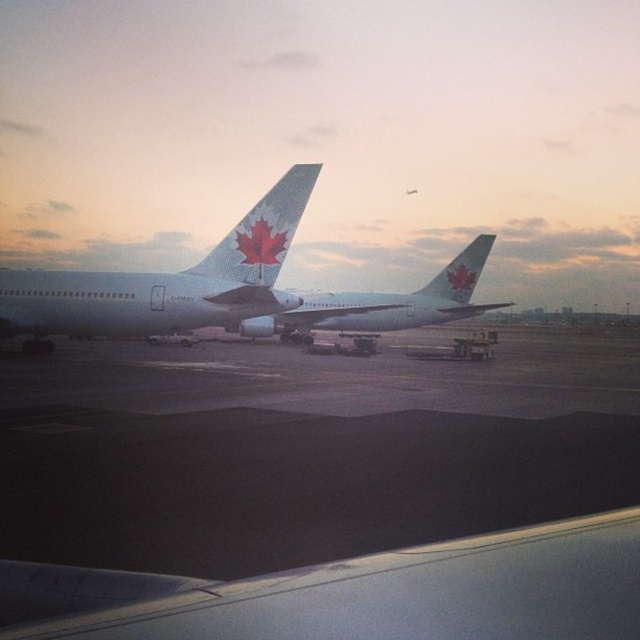
You are a flight attendant on an airplane and you notice two objects in the scene. One is the matte white airplane at center and the other is the matte white tail at center. Which object is positioned lower in the image?

The matte white airplane at center is positioned lower than the matte white tail at center in the image.

You are a passenger sitting in the airplane and looking out the window. You see the white matte airplane at left and the matte white tail at center. Which one is positioned to the left side?

The white matte airplane at left is positioned to the left of the matte white tail at center.

You are a pilot preparing for takeoff and need to ensure there is enough vertical clearance between your aircraft and the nearby structures. You observe the matte white airplane at center and the matte white tail at center in your line of sight. Which object is taller, and does this affect your clearance calculation?

The matte white airplane at center is taller than the matte white tail at center. Since the airplane itself is taller, this would be the critical factor in calculating vertical clearance, as the tail section is part of the airplane and its height is included in the overall aircraft dimensions.